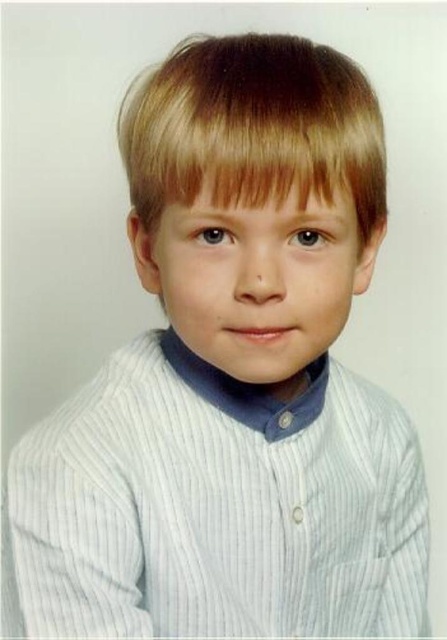
The young boy in the image has two distinct features visible. Based on the description, which of the following is wider when viewed from the front? The blonde silky hair at upper center or the smooth skin face at center?

The blonde silky hair at upper center is wider than the smooth skin face at center.

The image shows a young boy wearing a striped shirt. There is a point marked at coordinates (253, 129). What does this point represent?

The point at coordinates (253, 129) represents the blonde silky hair at upper center of the boy.

You are a photographer adjusting the lighting for a portrait. The subject has blonde silky hair at upper center. Based on the image, where should you position the main light to ensure it illuminates the hair effectively?

The main light should be positioned to the right of the blonde silky hair at upper center since the hair is located at point 0.202 on the x axis, which is to the left side of the image. This will help highlight the hair effectively.